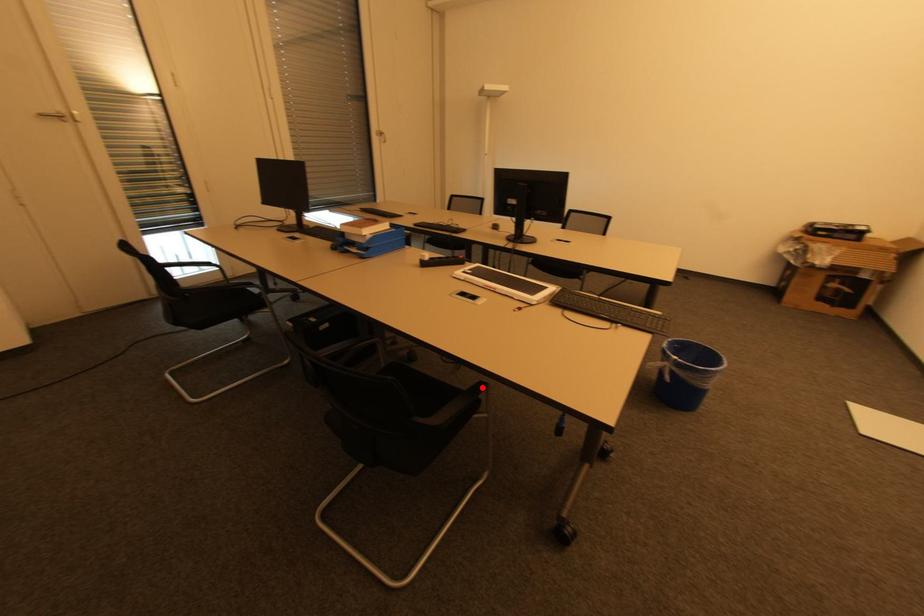
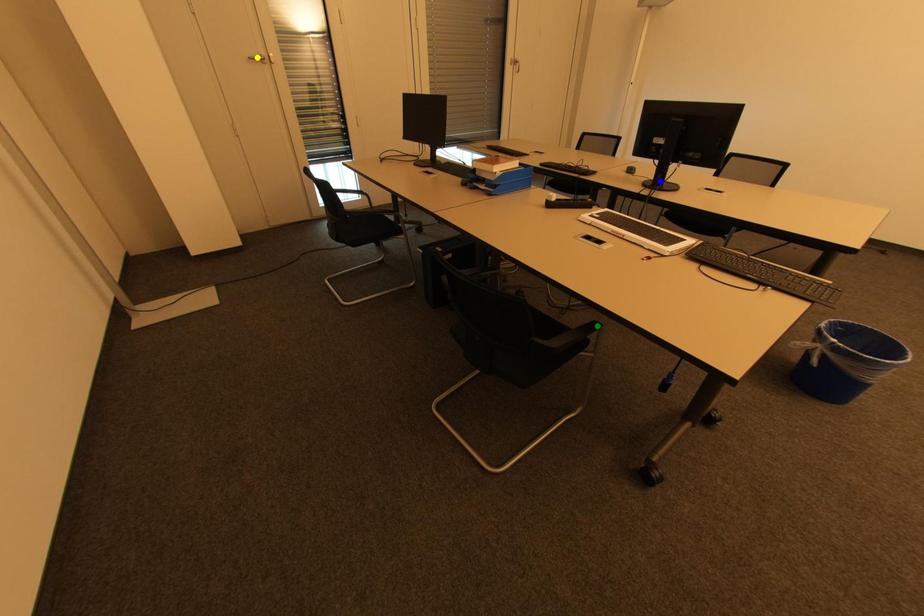
Question: I am providing you with two images of the same scene from different viewpoints. A red point is marked on the first image. You are given multiple points on the second image. Which point in image 2 is actually the same real-world point as the red point in image 1?

Choices:
 (A) green point
 (B) yellow point
 (C) blue point

Answer: (A)